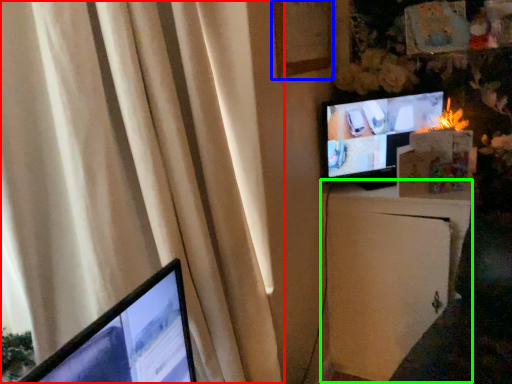
Question: Based on their relative distances, which object is nearer to curtain (highlighted by a red box)? Choose from picture frame (highlighted by a blue box) and file cabinet (highlighted by a green box).

Choices:
 (A) picture frame
 (B) file cabinet

Answer: (A)